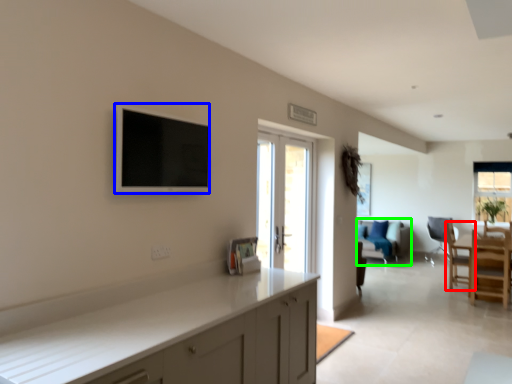
Question: Estimate the real-world distances between objects in this image. Which object is closer to chair (highlighted by a red box), flat (highlighted by a blue box) or couch (highlighted by a green box)?

Choices:
 (A) flat
 (B) couch

Answer: (B)